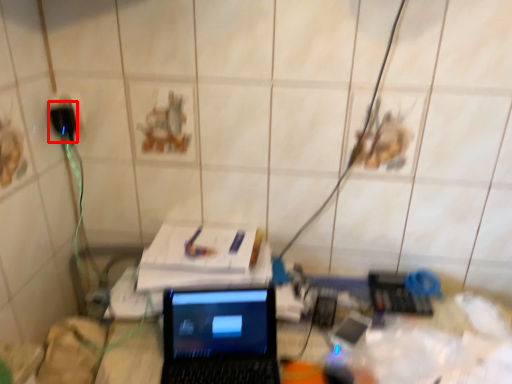
Question: From the image's perspective, where is plug (annotated by the red box) located relative to laptop?

Choices:
 (A) above
 (B) below

Answer: (A)